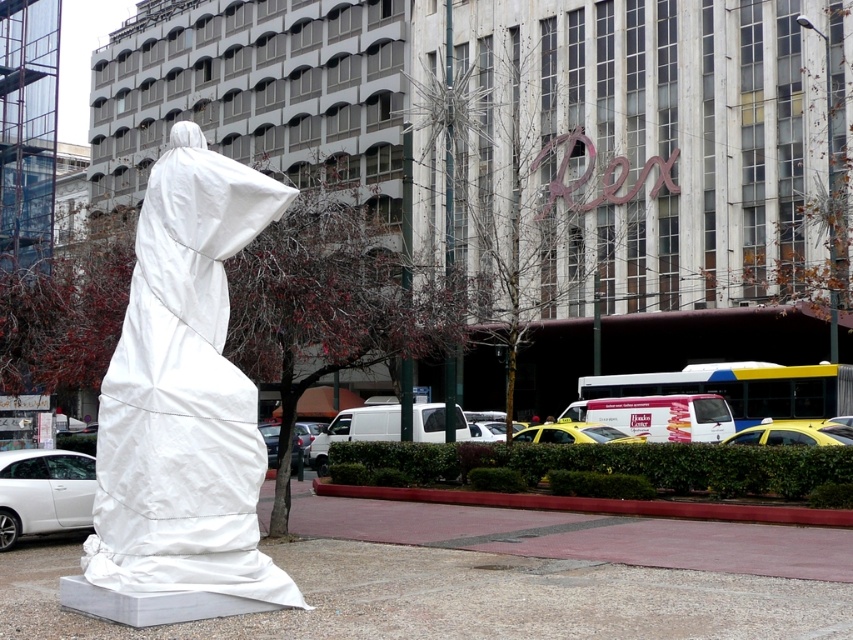
Is point (772, 435) farther from viewer compared to point (548, 429)?

No, (772, 435) is closer to viewer.

Who is more forward, (x=781, y=438) or (x=624, y=438)?

Point (x=781, y=438) is in front.

At what (x,y) coordinates should I click in order to perform the action: click on yellow matte taxi at lower right. Please return your answer as a coordinate pair (x, y). Looking at the image, I should click on (793, 433).

Does white matte car at lower left have a lesser height compared to yellow matte taxi at lower right?

No, white matte car at lower left is not shorter than yellow matte taxi at lower right.

Can you confirm if white matte car at lower left is positioned to the left of yellow matte taxi at lower right?

Correct, you'll find white matte car at lower left to the left of yellow matte taxi at lower right.

I want to click on white matte car at lower left, so click(x=44, y=492).

Does white matte car at lower left come behind yellow matte taxi at center?

No, white matte car at lower left is in front of yellow matte taxi at center.

Is point (24, 497) farther from camera compared to point (521, 435)?

No.

The width and height of the screenshot is (853, 640). Identify the location of white matte car at lower left. (44, 492).